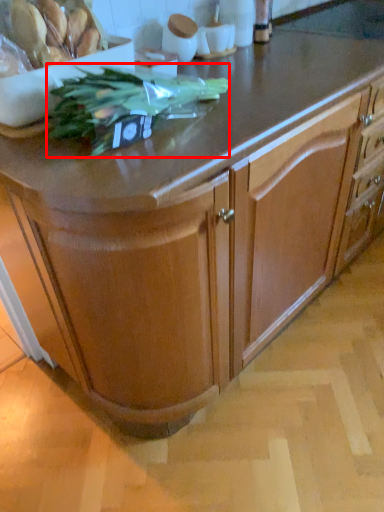
Question: From the image's perspective, what is the correct spatial relationship of plant (annotated by the red box) in relation to food?

Choices:
 (A) below
 (B) above

Answer: (A)